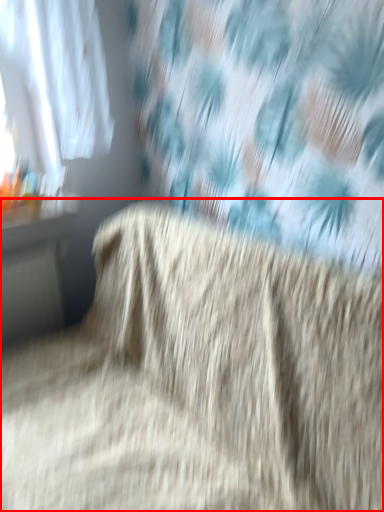
Question: From the image's perspective, what is the correct spatial relationship of furniture (annotated by the red box) in relation to table?

Choices:
 (A) below
 (B) above

Answer: (A)